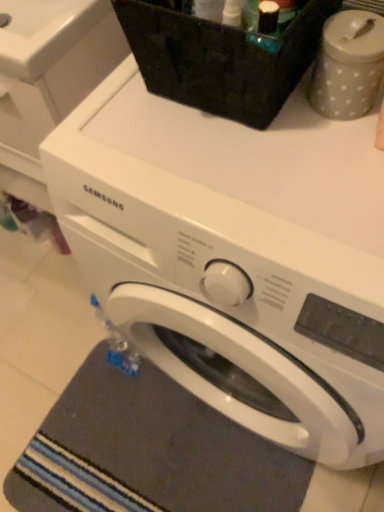
You are a GUI agent. You are given a task and a screenshot of the screen. Output one action in this format:
    pyautogui.click(x=<x>, y=<y>)
    Task: Click on the white glossy sink at upper left
    Image resolution: width=384 pixels, height=512 pixels.
    Given the screenshot: What is the action you would take?
    pyautogui.click(x=43, y=33)

Where is `white glossy washing machine at center, which is the 2th washing machine from left to right`? white glossy washing machine at center, which is the 2th washing machine from left to right is located at coordinates (236, 257).

In order to face white glossy washing machine at center, placed as the first washing machine when sorted from right to left, should I rotate leftwards or rightwards?

It's best to rotate right around 10.972 degrees.

Measure the distance between point (327, 47) and camera.

The distance of point (327, 47) from camera is 19.41 inches.

In order to click on white glossy sink at upper left in this screenshot , I will do click(43, 33).

Is white glossy sink at upper left in front of or behind white glossy washing machine at center, placed as the first washing machine when sorted from right to left, in the image?

white glossy sink at upper left is positioned farther from the viewer than white glossy washing machine at center, placed as the first washing machine when sorted from right to left.

Is white glossy sink at upper left taller than white glossy washing machine at center, which is the 2th washing machine from left to right?

Incorrect, the height of white glossy sink at upper left is not larger of that of white glossy washing machine at center, which is the 2th washing machine from left to right.

Does white glossy sink at upper left touch white glossy washing machine at center, placed as the first washing machine when sorted from right to left?

No, white glossy sink at upper left is not touching white glossy washing machine at center, placed as the first washing machine when sorted from right to left.

Based on the photo, does white glossy sink at upper left have a larger size compared to white glossy washing machine at center, placed as the first washing machine when sorted from right to left?

Actually, white glossy sink at upper left might be smaller than white glossy washing machine at center, placed as the first washing machine when sorted from right to left.

Looking at their sizes, would you say white glossy washing machine at center, placed as the first washing machine when sorted from right to left, is wider or thinner than dark gray textured bath mat at lower left?

Considering their sizes, white glossy washing machine at center, placed as the first washing machine when sorted from right to left, looks broader than dark gray textured bath mat at lower left.

Is white glossy washing machine at center, placed as the first washing machine when sorted from right to left, positioned beyond the bounds of dark gray textured bath mat at lower left?

white glossy washing machine at center, placed as the first washing machine when sorted from right to left, lies outside dark gray textured bath mat at lower left's area.

Can you confirm if white glossy washing machine at center, placed as the first washing machine when sorted from right to left, is positioned to the left of dark gray textured bath mat at lower left?

No.

Between white glossy washing machine at center, placed as the first washing machine when sorted from right to left, and dark gray textured bath mat at lower left, which one has larger size?

white glossy washing machine at center, placed as the first washing machine when sorted from right to left.

Can you confirm if white matte washing machine at upper center, which appears as the 1th washing machine when viewed from the left, is smaller than gray dotted container at upper right?

Actually, white matte washing machine at upper center, which appears as the 1th washing machine when viewed from the left, might be larger than gray dotted container at upper right.

Can you confirm if white matte washing machine at upper center, which appears as the 1th washing machine when viewed from the left, is thinner than gray dotted container at upper right?

No, white matte washing machine at upper center, which appears as the 1th washing machine when viewed from the left, is not thinner than gray dotted container at upper right.

From a real-world perspective, is white matte washing machine at upper center, which is counted as the second washing machine, starting from the right, located higher than gray dotted container at upper right?

No.

Between dark gray textured bath mat at lower left and white glossy washing machine at center, placed as the first washing machine when sorted from right to left, which one appears on the left side from the viewer's perspective?

Positioned to the left is dark gray textured bath mat at lower left.

Is dark gray textured bath mat at lower left looking in the opposite direction of white glossy washing machine at center, which is the 2th washing machine from left to right?

dark gray textured bath mat at lower left does not have its back to white glossy washing machine at center, which is the 2th washing machine from left to right.

Which is closer, (x=199, y=483) or (x=90, y=210)?

Point (x=199, y=483) appears to be farther away from the viewer than point (x=90, y=210).

This screenshot has width=384, height=512. Find the location of `sink that is under the gray dotted container at upper right (from a real-world perspective)`. sink that is under the gray dotted container at upper right (from a real-world perspective) is located at coordinates (43, 33).

Considering the points (314, 63) and (38, 70), which point is behind, point (314, 63) or point (38, 70)?

The point (38, 70) is farther from the camera.

Considering the sizes of objects gray dotted container at upper right and white glossy sink at upper left in the image provided, who is taller, gray dotted container at upper right or white glossy sink at upper left?

With more height is gray dotted container at upper right.

Can you confirm if gray dotted container at upper right is positioned to the right of white glossy sink at upper left?

Indeed, gray dotted container at upper right is positioned on the right side of white glossy sink at upper left.

How far apart are white glossy washing machine at center, which is the 2th washing machine from left to right, and white matte washing machine at upper center, which is counted as the second washing machine, starting from the right?

white glossy washing machine at center, which is the 2th washing machine from left to right, is 14.98 inches away from white matte washing machine at upper center, which is counted as the second washing machine, starting from the right.

Between white glossy washing machine at center, which is the 2th washing machine from left to right, and white matte washing machine at upper center, which is counted as the second washing machine, starting from the right, which one has more height?

white glossy washing machine at center, which is the 2th washing machine from left to right, is taller.

Is white glossy washing machine at center, which is the 2th washing machine from left to right, positioned with its back to white matte washing machine at upper center, which is counted as the second washing machine, starting from the right?

white glossy washing machine at center, which is the 2th washing machine from left to right, does not have its back to white matte washing machine at upper center, which is counted as the second washing machine, starting from the right.

Is point (6, 47) closer or farther from the camera than point (101, 345)?

Point (6, 47) is positioned closer to the camera compared to point (101, 345).

Is white matte washing machine at upper center, which appears as the 1th washing machine when viewed from the left, oriented towards dark gray textured bath mat at lower left?

No, white matte washing machine at upper center, which appears as the 1th washing machine when viewed from the left, does not turn towards dark gray textured bath mat at lower left.

Based on the photo, is white matte washing machine at upper center, which appears as the 1th washing machine when viewed from the left, further to the viewer compared to dark gray textured bath mat at lower left?

No, white matte washing machine at upper center, which appears as the 1th washing machine when viewed from the left, is in front of dark gray textured bath mat at lower left.

Who is taller, white matte washing machine at upper center, which appears as the 1th washing machine when viewed from the left, or dark gray textured bath mat at lower left?

Standing taller between the two is white matte washing machine at upper center, which appears as the 1th washing machine when viewed from the left.

From a real-world perspective, starting from the white glossy sink at upper left, which washing machine is the 2nd one below it? Please provide its 2D coordinates.

[(236, 257)]

Where is `bath mat on the left of white glossy washing machine at center, placed as the first washing machine when sorted from right to left`? bath mat on the left of white glossy washing machine at center, placed as the first washing machine when sorted from right to left is located at coordinates pos(164,446).

Looking at the image, which one is located further to white matte washing machine at upper center, which is counted as the second washing machine, starting from the right, gray dotted container at upper right or dark gray textured bath mat at lower left?

Based on the image, dark gray textured bath mat at lower left appears to be further to white matte washing machine at upper center, which is counted as the second washing machine, starting from the right.

When comparing their distances from white matte washing machine at upper center, which appears as the 1th washing machine when viewed from the left, does white glossy washing machine at center, placed as the first washing machine when sorted from right to left, or gray dotted container at upper right seem closer?

white glossy washing machine at center, placed as the first washing machine when sorted from right to left, is closer to white matte washing machine at upper center, which appears as the 1th washing machine when viewed from the left.

Estimate the real-world distances between objects in this image. Which object is further from gray dotted container at upper right, dark gray textured bath mat at lower left or white glossy washing machine at center, placed as the first washing machine when sorted from right to left?

Based on the image, dark gray textured bath mat at lower left appears to be further to gray dotted container at upper right.

Consider the image. Which object lies further to the anchor point white matte washing machine at upper center, which is counted as the second washing machine, starting from the right, white glossy washing machine at center, placed as the first washing machine when sorted from right to left, or white glossy sink at upper left?

white glossy washing machine at center, placed as the first washing machine when sorted from right to left, is further to white matte washing machine at upper center, which is counted as the second washing machine, starting from the right.

From the image, which object appears to be farther from white matte washing machine at upper center, which is counted as the second washing machine, starting from the right, dark gray textured bath mat at lower left or white glossy washing machine at center, which is the 2th washing machine from left to right?

dark gray textured bath mat at lower left.

Considering their positions, is white matte washing machine at upper center, which is counted as the second washing machine, starting from the right, positioned closer to white glossy washing machine at center, which is the 2th washing machine from left to right, than gray dotted container at upper right?

gray dotted container at upper right lies closer to white glossy washing machine at center, which is the 2th washing machine from left to right, than the other object.

Based on their spatial positions, is white matte washing machine at upper center, which is counted as the second washing machine, starting from the right, or white glossy washing machine at center, placed as the first washing machine when sorted from right to left, further from dark gray textured bath mat at lower left?

white matte washing machine at upper center, which is counted as the second washing machine, starting from the right.

Based on the photo, based on their spatial positions, is white glossy washing machine at center, which is the 2th washing machine from left to right, or dark gray textured bath mat at lower left closer to gray dotted container at upper right?

The object closer to gray dotted container at upper right is white glossy washing machine at center, which is the 2th washing machine from left to right.

I want to click on appliance between white glossy sink at upper left and dark gray textured bath mat at lower left in the vertical direction, so click(x=348, y=65).

Image resolution: width=384 pixels, height=512 pixels. Identify the location of appliance between white matte washing machine at upper center, which is counted as the second washing machine, starting from the right, and dark gray textured bath mat at lower left in the up-down direction. (348, 65).

Find the location of `washing machine that lies between gray dotted container at upper right and dark gray textured bath mat at lower left from top to bottom`. washing machine that lies between gray dotted container at upper right and dark gray textured bath mat at lower left from top to bottom is located at coordinates (236, 257).

Where is `washing machine between white matte washing machine at upper center, which is counted as the second washing machine, starting from the right, and dark gray textured bath mat at lower left in the up-down direction`? The width and height of the screenshot is (384, 512). washing machine between white matte washing machine at upper center, which is counted as the second washing machine, starting from the right, and dark gray textured bath mat at lower left in the up-down direction is located at coordinates (236, 257).